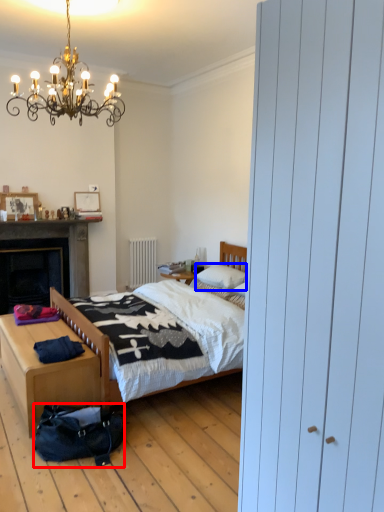
Question: Which of the following is the closest to the observer, bag (highlighted by a red box) or pillow (highlighted by a blue box)?

Choices:
 (A) bag
 (B) pillow

Answer: (A)